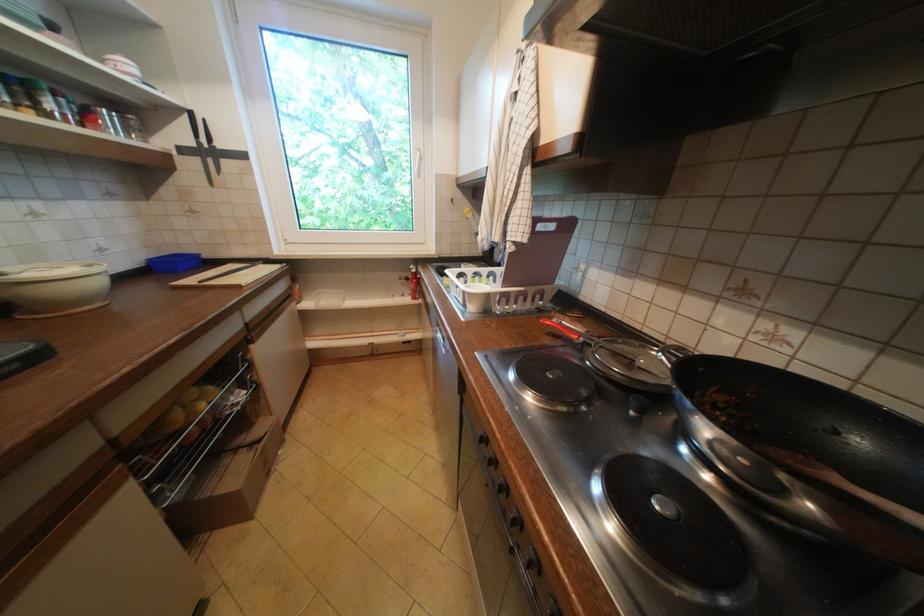
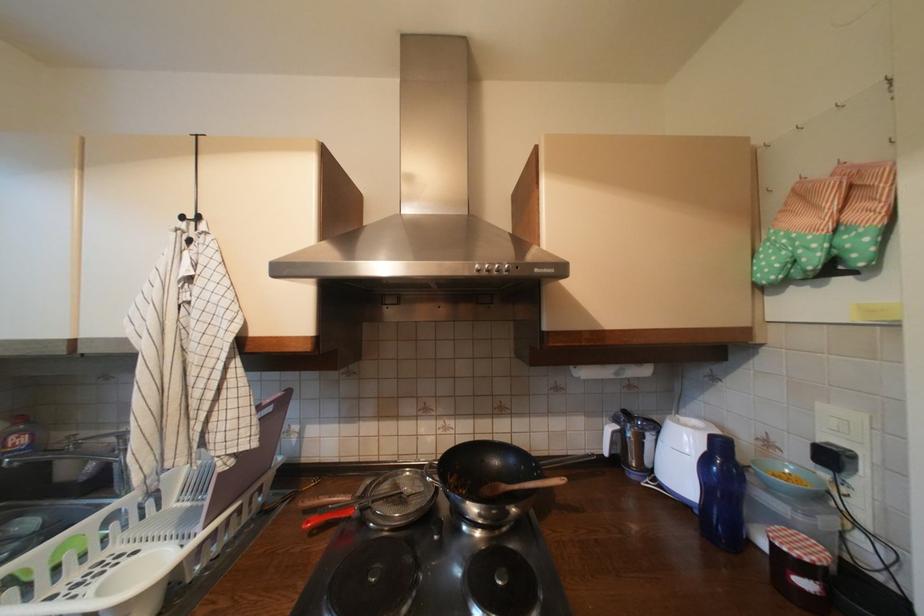
Question: How did the camera likely rotate?

Choices:
 (A) Left
 (B) Right
 (C) Up
 (D) Down

Answer: (B)